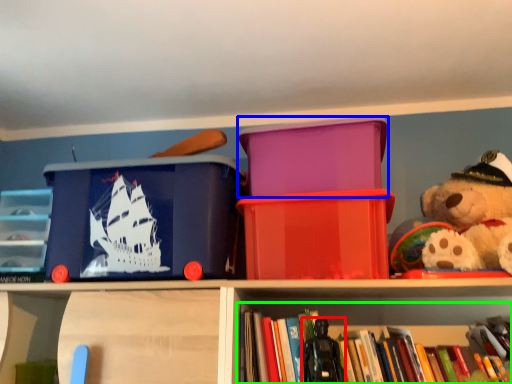
Question: Which object is the closest to the toy (highlighted by a red box)? Choose among these: storage box (highlighted by a blue box) or book (highlighted by a green box).

Choices:
 (A) storage box
 (B) book

Answer: (B)